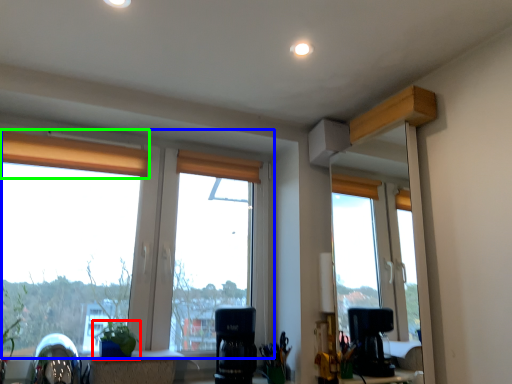
Question: Considering the real-world distances, which object is closest to houseplant (highlighted by a red box)? window (highlighted by a blue box) or curtain (highlighted by a green box).

Choices:
 (A) window
 (B) curtain

Answer: (A)